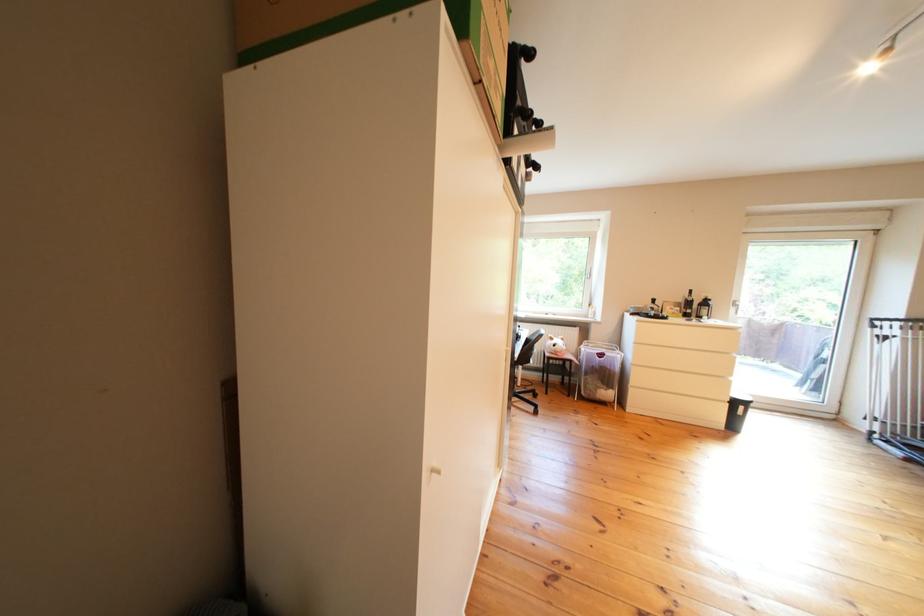
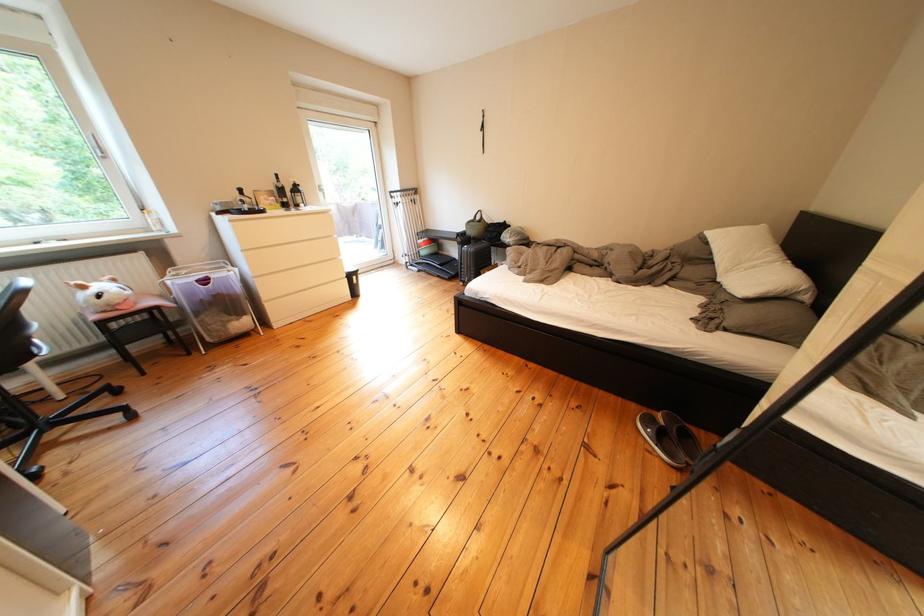
In the scene shown: Based on the continuous images, in which direction is the camera rotating?

The camera rotated toward right-down.